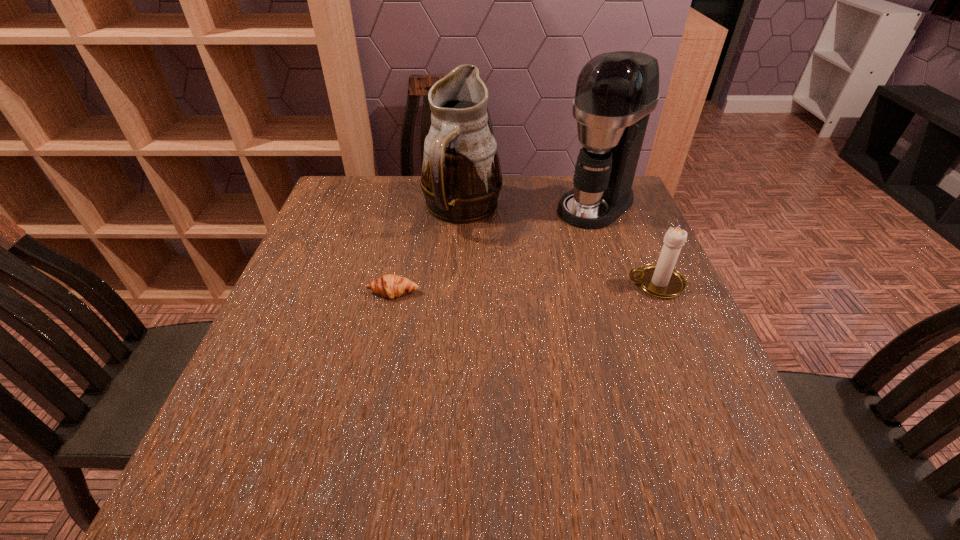
I want to click on the shortest object, so click(x=391, y=285).

Locate an element on the screen. the third tallest object is located at coordinates (661, 280).

Locate an element on the screen. the third shortest object is located at coordinates (461, 178).

I want to click on coffee maker, so click(x=615, y=93).

Find the location of a particular element. free point located 0.110m on the front-facing side of the shortest object is located at coordinates (383, 340).

I want to click on free location located 0.260m on the handle side of the candle holder, so click(514, 284).

Identify the location of vacant region located on the handle side of the candle holder. (479, 284).

This screenshot has width=960, height=540. Find the location of `vacant space located on the handle side of the candle holder`. vacant space located on the handle side of the candle holder is located at coordinates (558, 284).

In order to click on blank space located from the spout of the third shortest object in this screenshot , I will do `click(531, 328)`.

Locate an element on the screen. blank space located from the spout of the third shortest object is located at coordinates (501, 280).